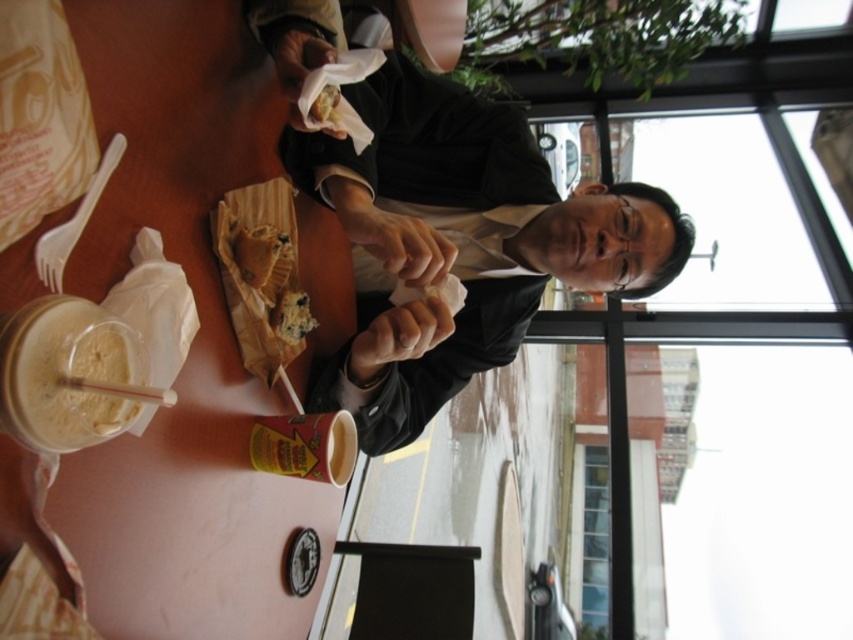
You are a waiter in a restaurant and need to determine if the matte black jacket at center can be placed on the table without covering the golden brown flaky pastry at center. Given that the table has enough space, can you confirm if the jacket is smaller than the pastry?

The matte black jacket at center is bigger than the golden brown flaky pastry at center, so placing the jacket on the table might cover the pastry since the jacket is larger.

From the picture: You are a customer at the dining establishment and want to place your napkin closer to the chocolate chip cookie at center. Based on the coordinates provided, where should you position the napkin?

The chocolate chip cookie at center is located at point (291, 316), so you should position the napkin near those coordinates to place it closer to the cookie.

Consider the image. You are a waiter in a restaurant and need to deliver a drink to the customer. The customer is wearing a matte black jacket at center and has a white creamy smoothie at lower left on the table. Where should you place the new drink to avoid spilling the existing one?

Place the new drink away from the white creamy smoothie at lower left since the matte black jacket at center is above it, indicating the jacket is closer to the edge of the table where reaching might cause spills.